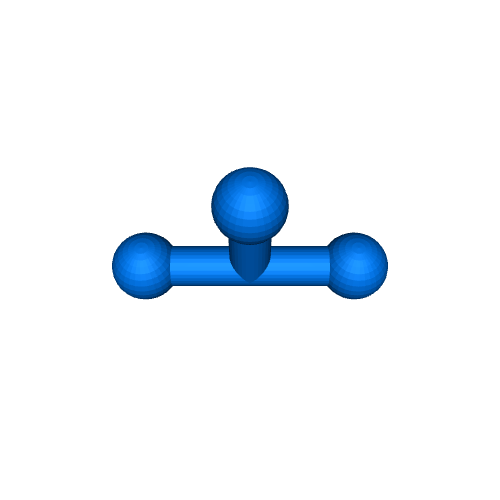
At what (x,y) coordinates should I click in order to perform the action: click on bar. Please return your answer as a coordinate pair (x, y). Looking at the image, I should click on click(206, 291).